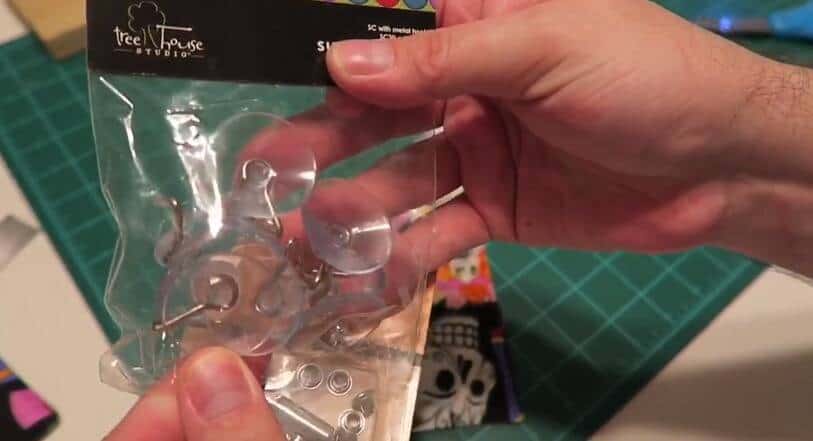
You are a GUI agent. You are given a task and a screenshot of the screen. Output one action in this format:
    pyautogui.click(x=<x>, y=<y>)
    Task: Click on the cutting mat
    
    Given the screenshot: What is the action you would take?
    pyautogui.click(x=584, y=305)